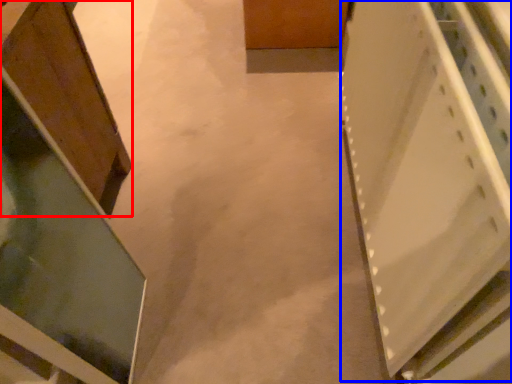
Question: Which object appears farthest to the camera in this image, cabinetry (highlighted by a red box) or cabinetry (highlighted by a blue box)?

Choices:
 (A) cabinetry
 (B) cabinetry

Answer: (A)